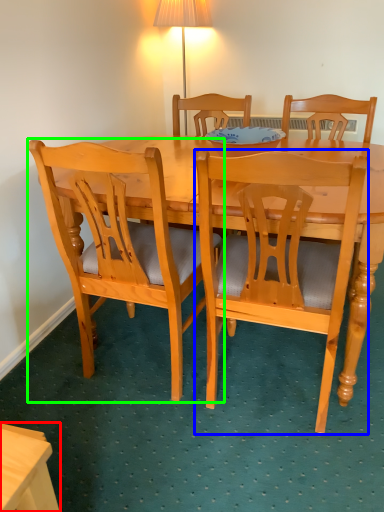
Question: Based on their relative distances, which object is farther from desk (highlighted by a red box)? Choose from chair (highlighted by a blue box) and chair (highlighted by a green box).

Choices:
 (A) chair
 (B) chair

Answer: (A)